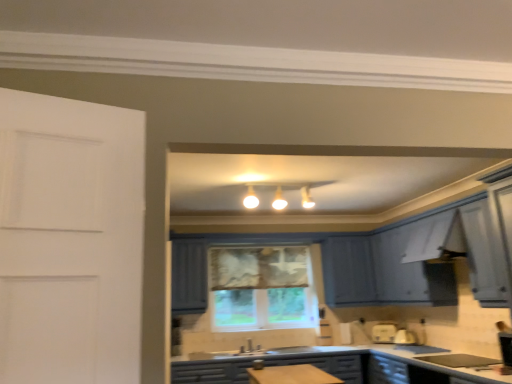
Identify the location of matte white window at center. The width and height of the screenshot is (512, 384). (261, 288).

The width and height of the screenshot is (512, 384). What do you see at coordinates (261, 288) in the screenshot? I see `matte white window at center` at bounding box center [261, 288].

This screenshot has height=384, width=512. Describe the element at coordinates (211, 371) in the screenshot. I see `matte blue cabinets at center` at that location.

I want to click on matte blue cabinets at center, so click(x=211, y=371).

Identify the location of matte white window at center. Image resolution: width=512 pixels, height=384 pixels. (261, 288).

Can you confirm if matte blue cabinets at center is positioned to the right of matte white window at center?

Yes, matte blue cabinets at center is to the right of matte white window at center.

Which is behind, matte blue cabinets at center or matte white window at center?

matte white window at center is more distant.

Is point (181, 383) in front of point (247, 252)?

Yes, it is in front of point (247, 252).

From the image's perspective, who appears lower, matte blue cabinets at center or matte white window at center?

matte blue cabinets at center, from the image's perspective.

From a real-world perspective, which object rests below the other?

matte blue cabinets at center.

Does matte blue cabinets at center have a lesser width compared to matte white window at center?

Incorrect, the width of matte blue cabinets at center is not less than that of matte white window at center.

Considering the sizes of objects matte blue cabinets at center and matte white window at center in the image provided, who is shorter, matte blue cabinets at center or matte white window at center?

matte blue cabinets at center is shorter.

Between matte blue cabinets at center and matte white window at center, which one has larger size?

With larger size is matte blue cabinets at center.

Can we say matte blue cabinets at center lies outside matte white window at center?

Indeed, matte blue cabinets at center is completely outside matte white window at center.

Is matte blue cabinets at center with matte white window at center?

There is a gap between matte blue cabinets at center and matte white window at center.

Is matte blue cabinets at center facing towards matte white window at center?

No, matte blue cabinets at center does not turn towards matte white window at center.

How many degrees apart are the facing directions of matte blue cabinets at center and matte white window at center?

matte blue cabinets at center and matte white window at center are facing 0.00154 degrees away from each other.

Measure the distance between matte blue cabinets at center and matte white window at center.

matte blue cabinets at center is 89.91 centimeters away from matte white window at center.

The image size is (512, 384). I want to click on window behind the matte blue cabinets at center, so click(x=261, y=288).

Based on their positions, is matte white window at center located to the left or right of matte blue cabinets at center?

In the image, matte white window at center appears on the left side of matte blue cabinets at center.

Is the position of matte white window at center less distant than that of matte blue cabinets at center?

No, matte white window at center is behind matte blue cabinets at center.

Is point (236, 305) positioned before point (240, 365)?

No, it is not.

Based on the photo, from the image's perspective, relative to matte blue cabinets at center, is matte white window at center above or below?

Clearly, from the image's perspective, matte white window at center is above matte blue cabinets at center.

From a real-world perspective, who is located lower, matte white window at center or matte blue cabinets at center?

From a 3D spatial view, matte blue cabinets at center is below.

Does matte white window at center have a lesser width compared to matte blue cabinets at center?

Correct, the width of matte white window at center is less than that of matte blue cabinets at center.

Considering the relative sizes of matte white window at center and matte blue cabinets at center in the image provided, is matte white window at center shorter than matte blue cabinets at center?

In fact, matte white window at center may be taller than matte blue cabinets at center.

Considering the sizes of matte white window at center and matte blue cabinets at center in the image, is matte white window at center bigger or smaller than matte blue cabinets at center?

In the image, matte white window at center appears to be smaller than matte blue cabinets at center.

Is matte white window at center completely or partially outside of matte blue cabinets at center?

matte white window at center is positioned outside matte blue cabinets at center.

Are matte white window at center and matte blue cabinets at center located far from each other?

They are positioned close to each other.

Is matte white window at center aimed at matte blue cabinets at center?

No.

Measure the distance between matte white window at center and matte blue cabinets at center.

matte white window at center is 35.40 inches away from matte blue cabinets at center.

Image resolution: width=512 pixels, height=384 pixels. Find the location of `cabinetry beneath the matte white window at center (from a real-world perspective)`. cabinetry beneath the matte white window at center (from a real-world perspective) is located at coordinates [x=211, y=371].

Find the location of a particular element. Image resolution: width=512 pixels, height=384 pixels. window positioned vertically above the matte blue cabinets at center (from a real-world perspective) is located at coordinates (261, 288).

Identify the location of cabinetry that is in front of the matte white window at center. (211, 371).